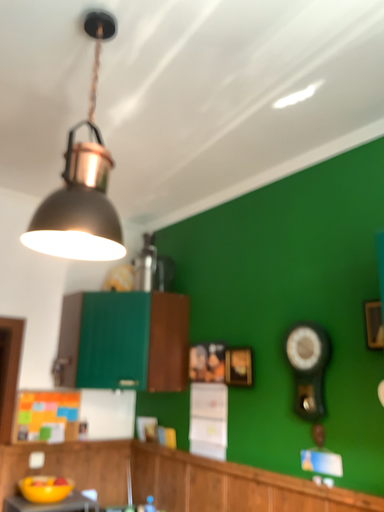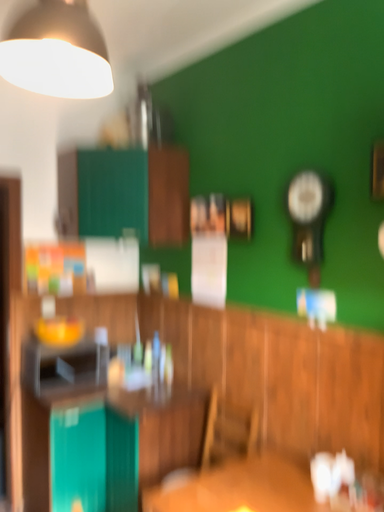
Question: How did the camera likely rotate when shooting the video?

Choices:
 (A) rotated upward
 (B) rotated downward

Answer: (B)